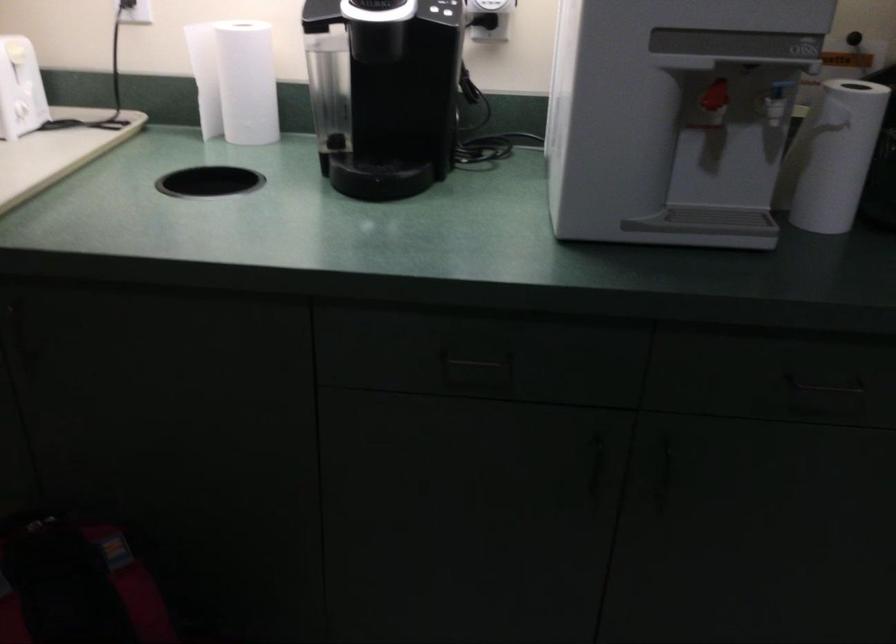
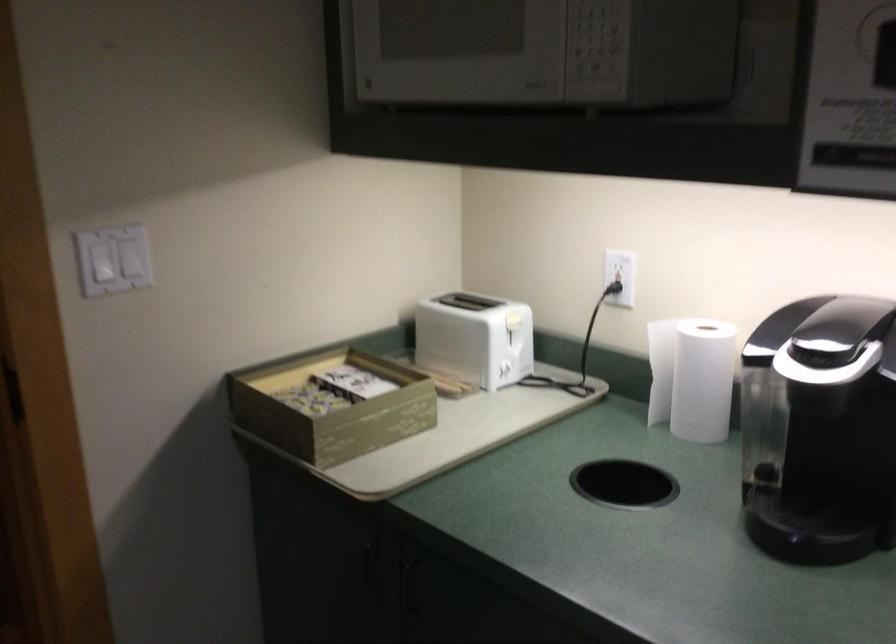
Find the pixel in the second image that matches pixel 252 75 in the first image.

(702, 380)